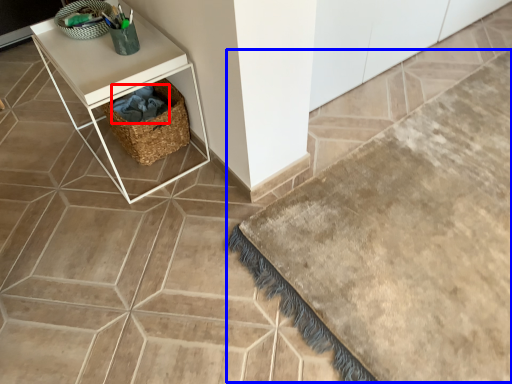
Question: Which object is further to the camera taking this photo, material (highlighted by a red box) or bath mat (highlighted by a blue box)?

Choices:
 (A) material
 (B) bath mat

Answer: (A)